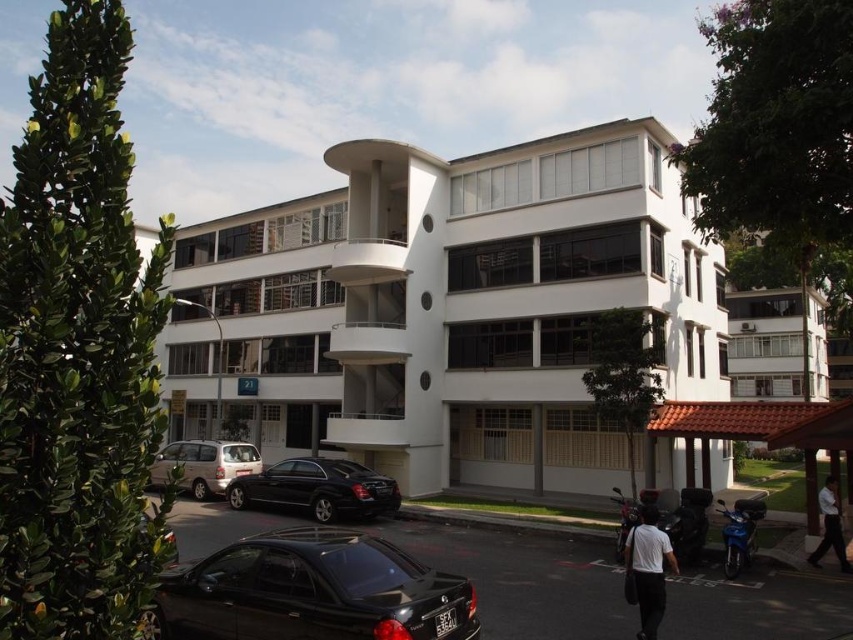
Is the position of shiny black sedan at center less distant than that of white matte shirt at lower right?

No, shiny black sedan at center is behind white matte shirt at lower right.

Where is `shiny black sedan at center`? This screenshot has height=640, width=853. shiny black sedan at center is located at coordinates (317, 488).

Between point (347, 493) and point (657, 589), which one is positioned in front?

Point (657, 589) is in front.

The height and width of the screenshot is (640, 853). I want to click on shiny black sedan at center, so click(317, 488).

The width and height of the screenshot is (853, 640). What do you see at coordinates (311, 592) in the screenshot?
I see `shiny black car at lower center` at bounding box center [311, 592].

Is point (457, 611) positioned before point (234, 458)?

Yes.

What are the coordinates of `shiny black car at lower center` in the screenshot? It's located at (311, 592).

From the picture: Can you confirm if white smooth building at center is thinner than white matte shirt at lower right?

In fact, white smooth building at center might be wider than white matte shirt at lower right.

Does white smooth building at center appear under white matte shirt at lower right?

Incorrect, white smooth building at center is not positioned below white matte shirt at lower right.

Who is more distant from viewer, (608,244) or (634,573)?

→ Point (608,244)

The image size is (853, 640). In order to click on white smooth building at center in this screenshot , I will do `click(447, 308)`.